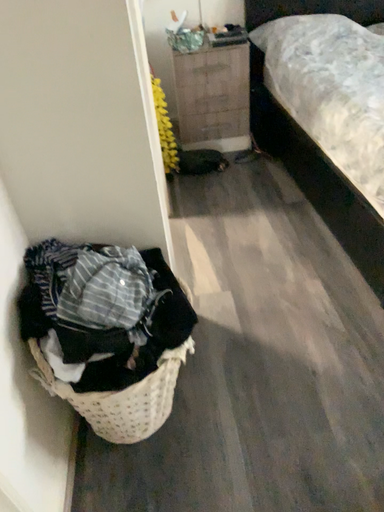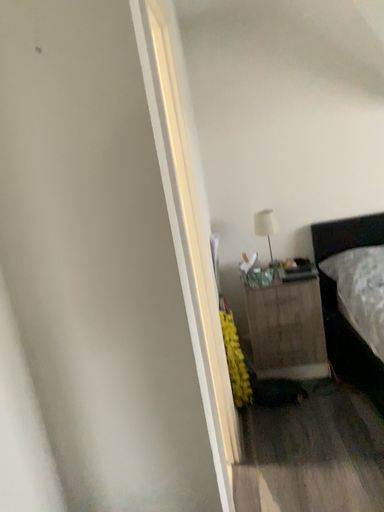
Question: Which way did the camera rotate in the video?

Choices:
 (A) rotated left
 (B) rotated right

Answer: (A)